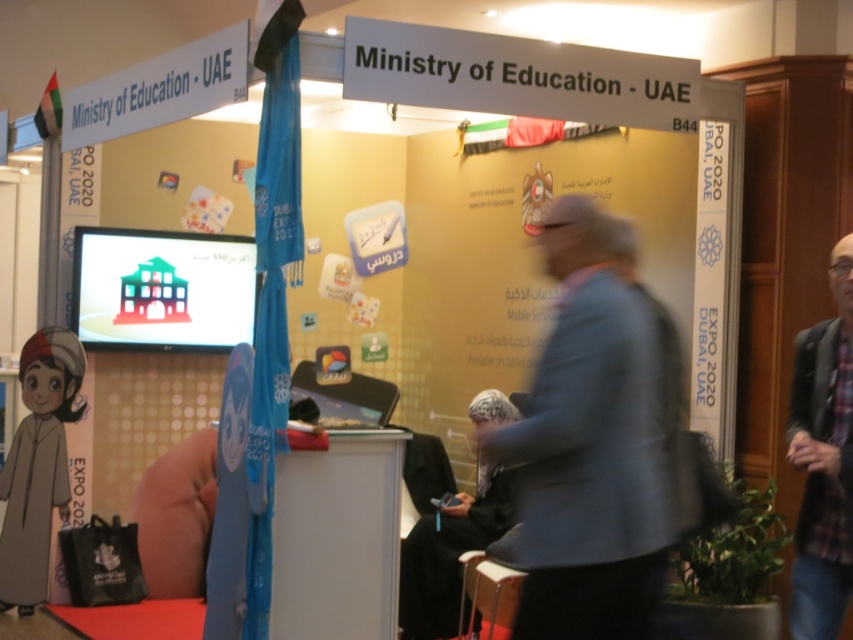
You are a visitor at the event booth and want to know which clothing item is shorter in height between the gray fabric jacket at center and the dark blue flannel shirt at right. Can you determine this?

The gray fabric jacket at center has a lesser height compared to the dark blue flannel shirt at right, so the gray fabric jacket at center is shorter in height.